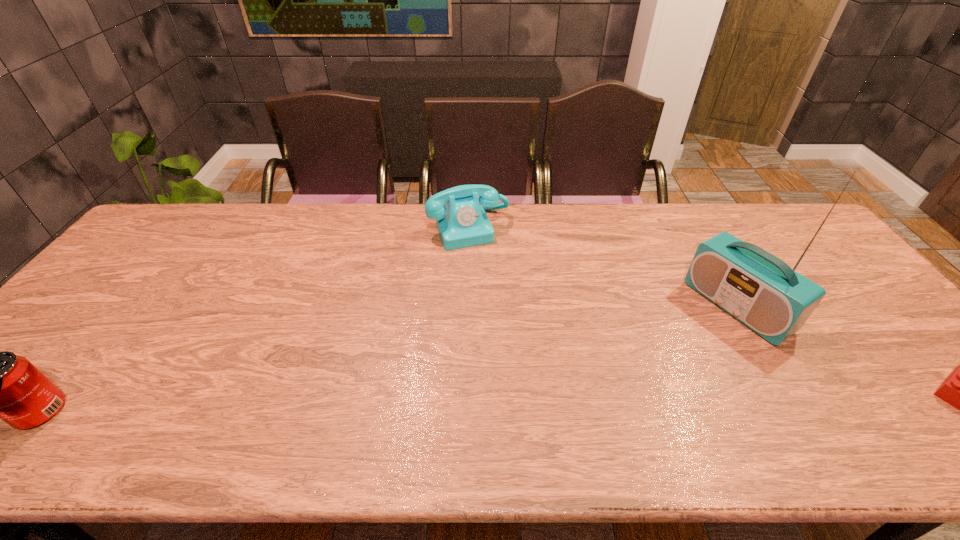
Locate an element on the screen. This screenshot has height=540, width=960. vacant space situated 0.300m on the front panel of the tallest object is located at coordinates (630, 382).

The width and height of the screenshot is (960, 540). In order to click on free location located 0.400m on the front panel of the tallest object in this screenshot , I will do `click(598, 403)`.

Locate an element on the screen. Image resolution: width=960 pixels, height=540 pixels. object that is at the far edge is located at coordinates [462, 222].

At what (x,y) coordinates should I click in order to perform the action: click on object that is at the near edge. Please return your answer as a coordinate pair (x, y). This screenshot has height=540, width=960. Looking at the image, I should click on (0, 385).

Identify the location of object present at the left edge. This screenshot has width=960, height=540. (0, 385).

You are a GUI agent. You are given a task and a screenshot of the screen. Output one action in this format:
    pyautogui.click(x=<x>, y=<y>)
    Task: Click on the object at the near left corner
    
    Given the screenshot: What is the action you would take?
    pyautogui.click(x=0, y=385)

Find the location of a particular element. free spot at the far edge of the desktop is located at coordinates (701, 224).

At what (x,y) coordinates should I click in order to perform the action: click on vacant space at the near edge of the desktop. Please return your answer as a coordinate pair (x, y). This screenshot has height=540, width=960. Looking at the image, I should click on (754, 399).

In the image, there is a desktop. At what (x,y) coordinates should I click in order to perform the action: click on free space at the left edge. Please return your answer as a coordinate pair (x, y). The image size is (960, 540). Looking at the image, I should click on (44, 362).

This screenshot has width=960, height=540. In the image, there is a desktop. In order to click on vacant space at the far left corner in this screenshot , I will do `click(165, 222)`.